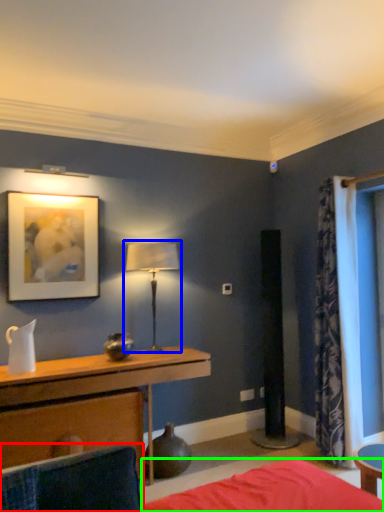
Question: Which object is positioned farthest from swivel chair (highlighted by a red box)? Select from table lamp (highlighted by a blue box) and bed frame (highlighted by a green box).

Choices:
 (A) table lamp
 (B) bed frame

Answer: (A)